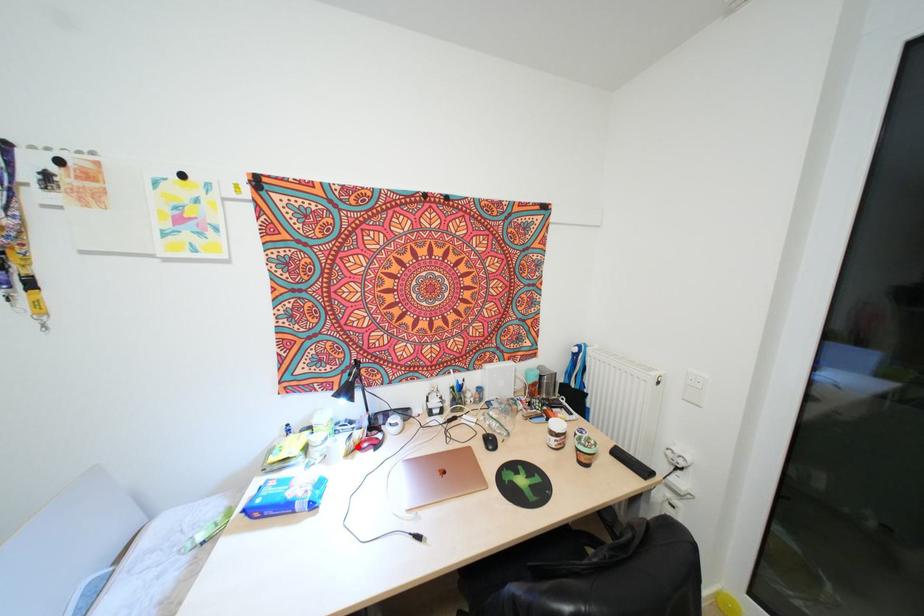
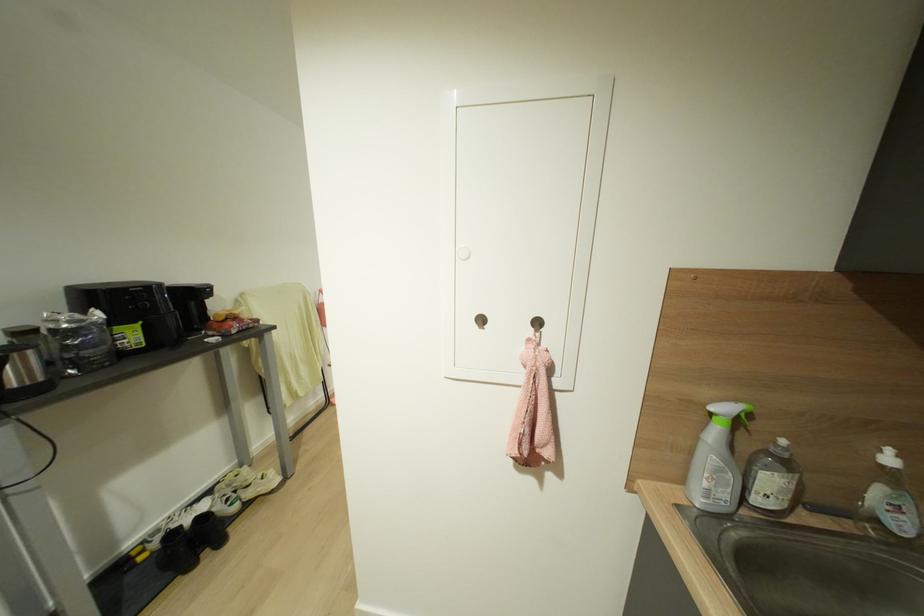
Question: I am providing you with two images of the same scene from different viewpoints. A red point is marked on the first image. Is the red point's position out of view in image 2?

Choices:
 (A) Yes
 (B) No

Answer: (A)